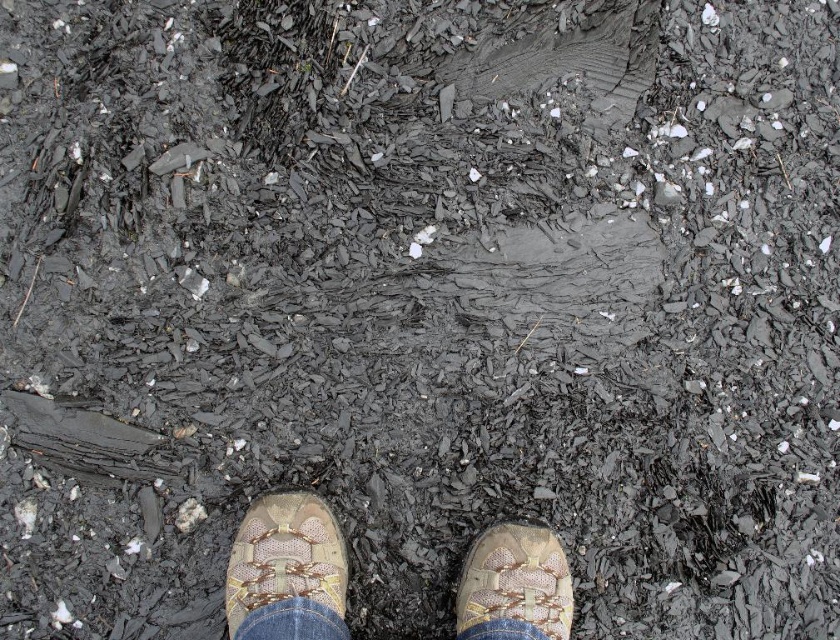
Based on the scene description, where is the tan suede shoe at lower center located in the image?

The tan suede shoe at lower center is located at point (x=285, y=556) in the image.

What are the coordinates of the tan mesh shoes at center?

The tan mesh shoes at center are located at coordinates point (286, 570).

In the scene shown: You are trying to decide which pair of shoes to wear for a hike. You see the tan mesh shoes at center and the tan suede shoe at lower center in the image. Based on their widths, which pair might be more comfortable for your wide feet?

The tan mesh shoes at center have a larger width than the tan suede shoe at lower center, so they might be more comfortable for your wide feet.